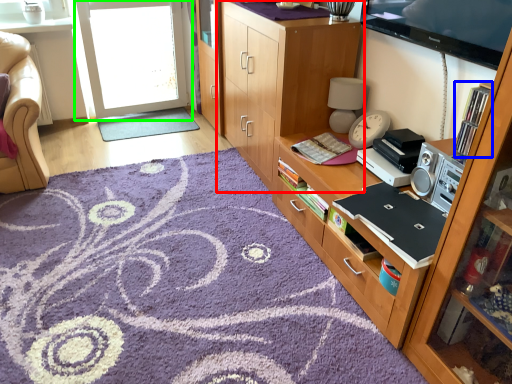
Question: Based on their relative distances, which object is farther from cabinetry (highlighted by a red box)? Choose from shelf (highlighted by a blue box) and screen door (highlighted by a green box).

Choices:
 (A) shelf
 (B) screen door

Answer: (B)